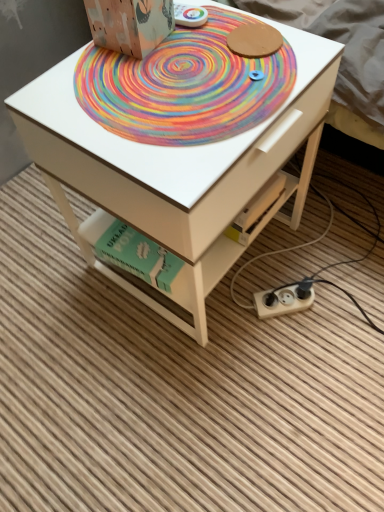
Locate an element on the screen. The height and width of the screenshot is (512, 384). free space in front of white plastic plug at lower right is located at coordinates (296, 365).